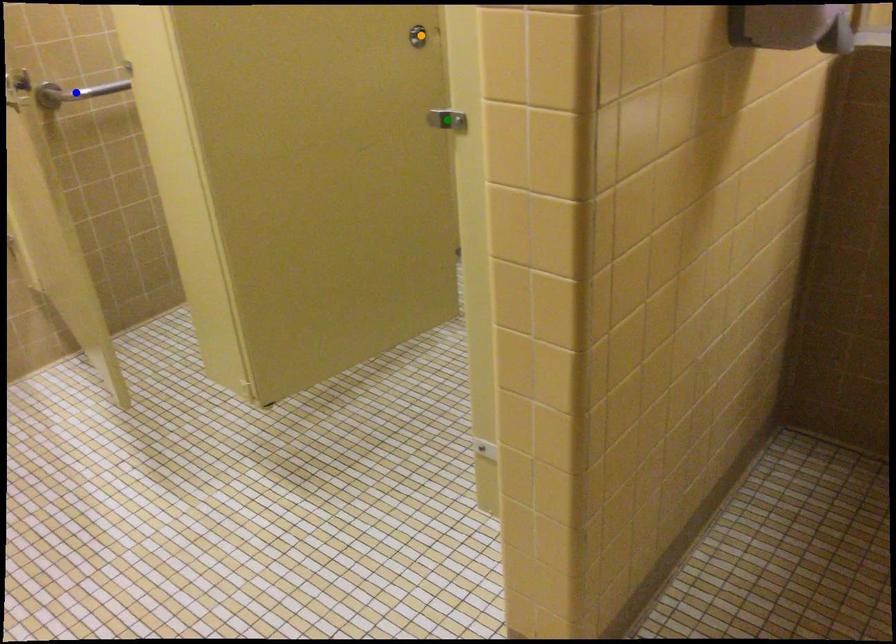
Order these from farthest to nearest:
blue point
orange point
green point

blue point → green point → orange point